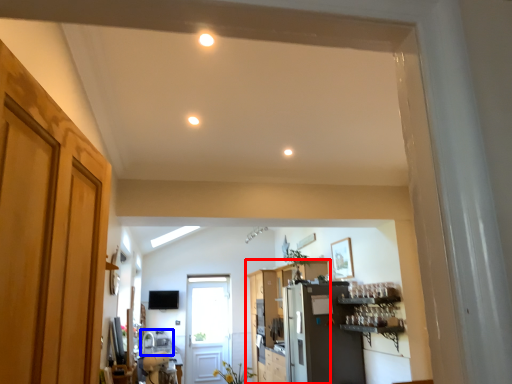
Question: Which point is further to the camera, cabinetry (highlighted by a red box) or sink (highlighted by a blue box)?

Choices:
 (A) cabinetry
 (B) sink

Answer: (A)